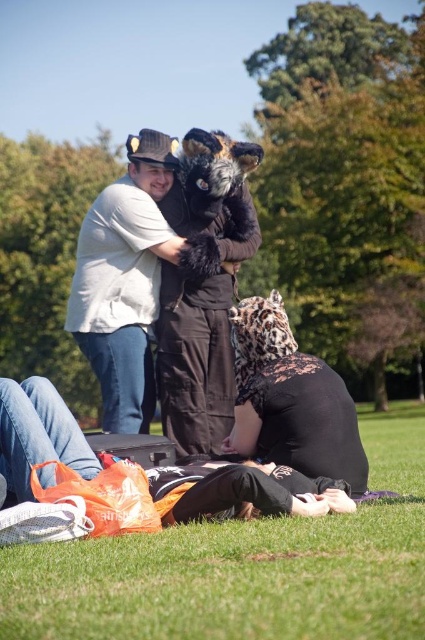
Question: Can you confirm if green grass at lower center is bigger than leopard print fabric at lower center?

Choices:
 (A) yes
 (B) no

Answer: (A)

Question: Which point is closer to the camera taking this photo?

Choices:
 (A) (90, 256)
 (B) (37, 602)

Answer: (B)

Question: Is white cotton shirt at center behind leopard print fabric at lower center?

Choices:
 (A) yes
 (B) no

Answer: (A)

Question: Can you confirm if green grass at lower center is thinner than white cotton shirt at center?

Choices:
 (A) yes
 (B) no

Answer: (B)

Question: Which point is farther to the camera?

Choices:
 (A) white cotton shirt at center
 (B) green grass at lower center
 (C) leopard print fabric at lower center

Answer: (A)

Question: Estimate the real-world distances between objects in this image. Which object is closer to the leopard print fabric at lower center?

Choices:
 (A) green grass at lower center
 (B) white cotton shirt at center

Answer: (A)